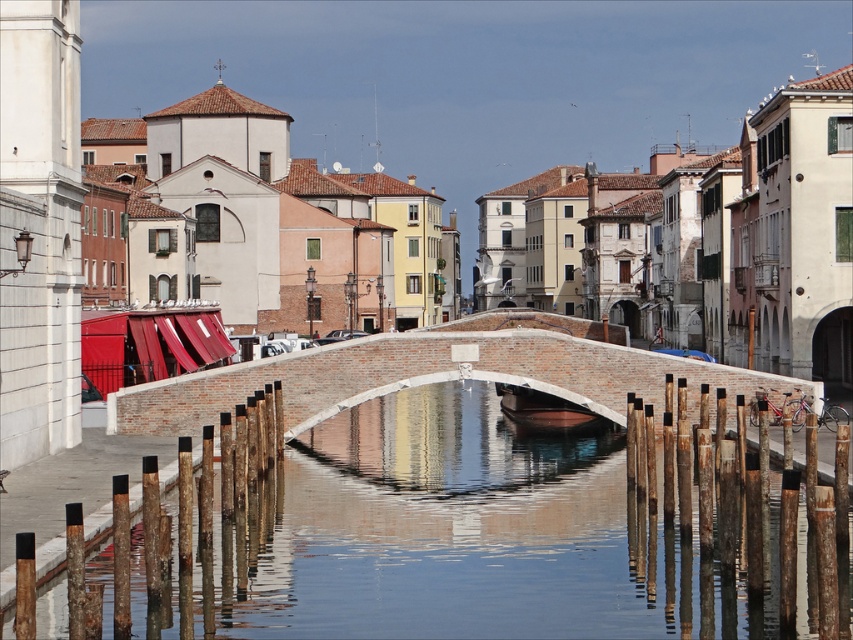
You are standing on the bridge and looking down at the canal. There is a specific point marked at coordinates point (457,538). What do you see at that exact location?

At point (457,538) lies clear water at bridge center.

You are a tourist standing on the canal bank and want to take a photo of the white brick bridge at center and the brown wooden boat at center. Which object will appear larger in your photo?

The white brick bridge at center will appear larger in the photo because it is taller than the brown wooden boat at center.

You are standing on the canal bank and want to take a photo of the white brick bridge at center and the clear water at bridge center. Which object will appear larger in your photo?

The clear water at bridge center will appear larger in your photo because it is closer to the viewer than the white brick bridge at center.